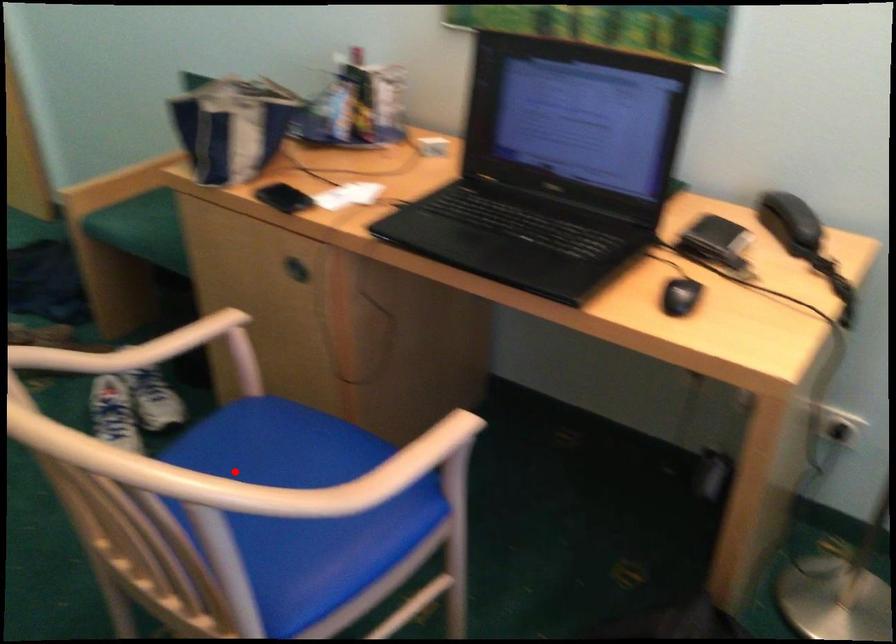
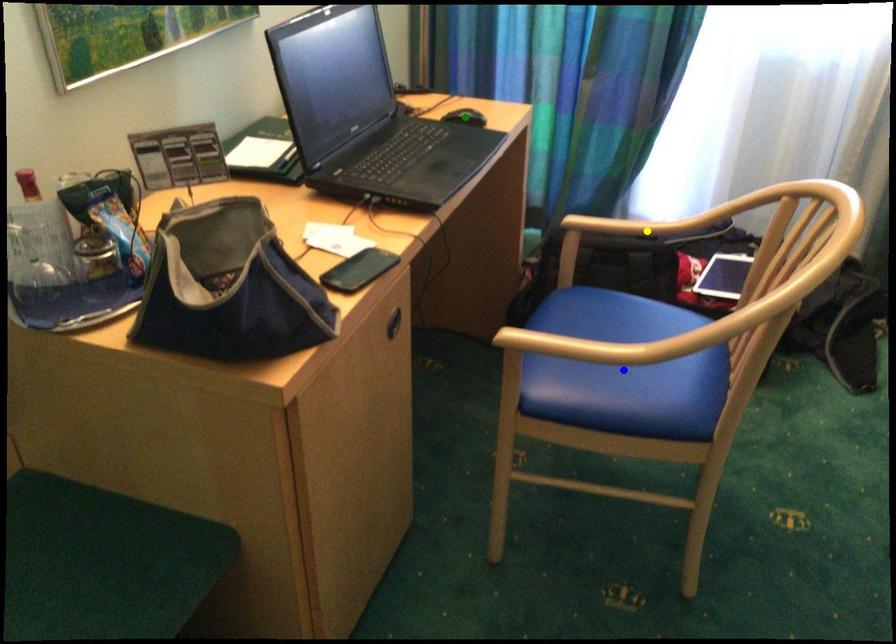
Question: I am providing you with two images of the same scene from different viewpoints. A red point is marked on the first image. You are given multiple points on the second image. Can you choose the point in image 2 that corresponds to the point in image 1?

Choices:
 (A) yellow point
 (B) blue point
 (C) green point

Answer: (B)